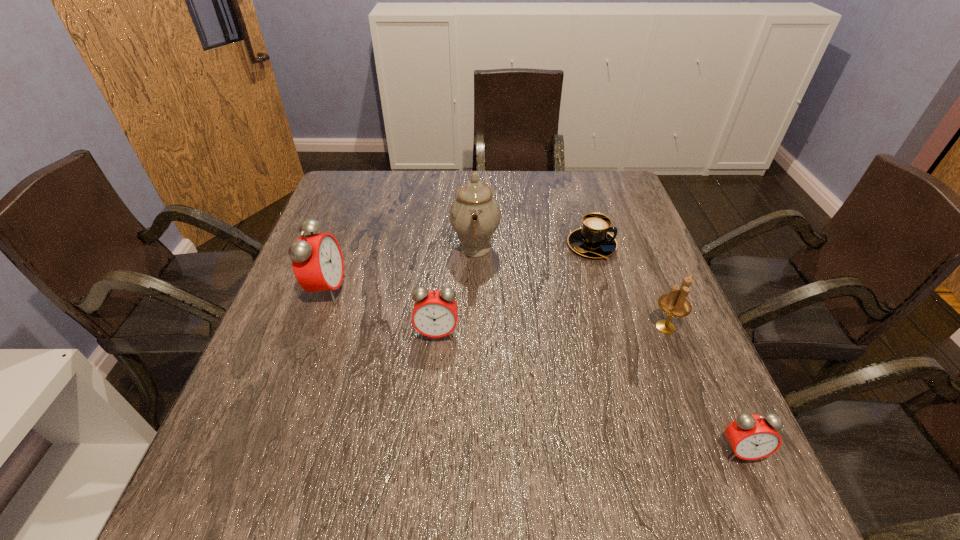
Please determine a free point for an extra alarm_clock to ensure balance. Please provide its 2D coordinates. Your answer should be formatted as a tuple, i.e. [(x, y)], where the tuple contains the x and y coordinates of a point satisfying the conditions above.

[(572, 385)]